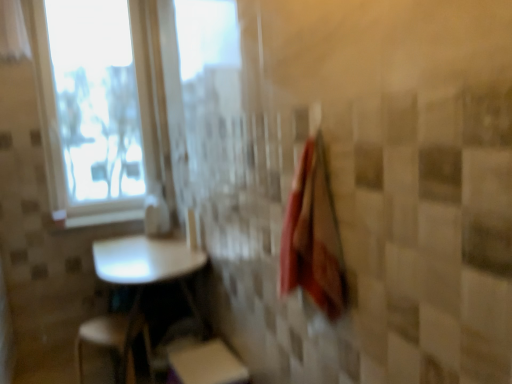
Question: Does point (82, 375) appear closer or farther from the camera than point (310, 276)?

Choices:
 (A) farther
 (B) closer

Answer: (A)

Question: Looking at the image, does white plastic step stool at lower left, placed as the 1th step stool when sorted from left to right, seem bigger or smaller compared to red cotton bath towel at right?

Choices:
 (A) big
 (B) small

Answer: (A)

Question: Considering the real-world distances, which object is closest to the white plastic step stool at lower left, which is the 2th step stool in right-to-left order?

Choices:
 (A) white sheer curtain at upper left
 (B) white glossy table at lower left
 (C) red cotton bath towel at right
 (D) white matte step stool at lower center, placed as the 1th step stool when sorted from right to left
 (E) white glossy window sill at upper left

Answer: (B)

Question: Considering the real-world distances, which object is closest to the white plastic step stool at lower left, which is the 2th step stool in right-to-left order?

Choices:
 (A) white glossy table at lower left
 (B) white glossy window sill at upper left
 (C) red cotton bath towel at right
 (D) white sheer curtain at upper left
 (E) transparent plastic window screen at upper left

Answer: (A)